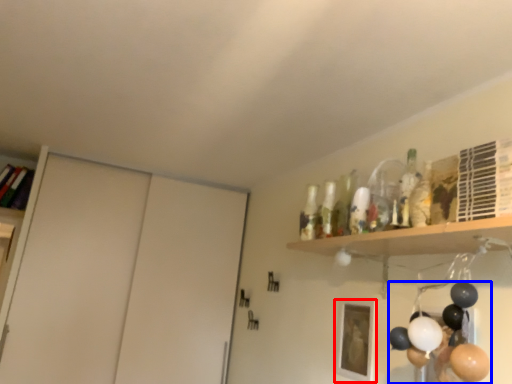
Question: Which of the following is the farthest to the observer, picture frame (highlighted by a red box) or balloon (highlighted by a blue box)?

Choices:
 (A) picture frame
 (B) balloon

Answer: (A)